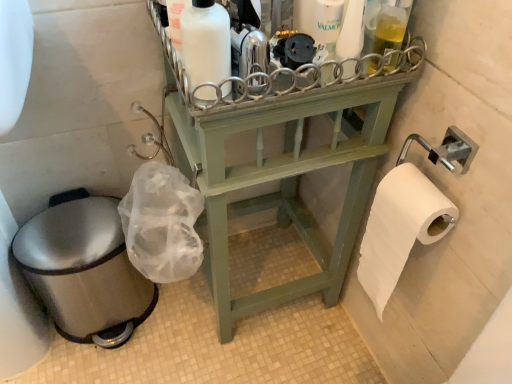
Measure the distance between brushed metal toilet bowl at lower left and camera.

brushed metal toilet bowl at lower left is 33.83 inches away from camera.

Measure the distance between light green wood shelf at center and camera.

light green wood shelf at center is 58.00 centimeters from camera.

The image size is (512, 384). Describe the element at coordinates (205, 42) in the screenshot. I see `white matte bottle at upper center` at that location.

Measure the distance between white matte bottle at upper center and camera.

They are 20.39 inches apart.

The image size is (512, 384). What do you see at coordinates (351, 31) in the screenshot? I see `white plastic bottle at upper center` at bounding box center [351, 31].

The image size is (512, 384). In order to click on white plastic bottle at upper center in this screenshot , I will do `click(351, 31)`.

Identify the location of brushed metal toilet bowl at lower left. (84, 271).

Is white matte bottle at upper center oriented towards brushed metal toilet bowl at lower left?

No, white matte bottle at upper center is not oriented towards brushed metal toilet bowl at lower left.

Is white matte bottle at upper center next to brushed metal toilet bowl at lower left?

white matte bottle at upper center and brushed metal toilet bowl at lower left are clearly separated.

Is brushed metal toilet bowl at lower left located within white matte bottle at upper center?

No, brushed metal toilet bowl at lower left is not surrounded by white matte bottle at upper center.

Who is bigger, light green wood shelf at center or white plastic bottle at upper center?

With larger size is light green wood shelf at center.

Does light green wood shelf at center appear on the left side of white plastic bottle at upper center?

Yes, light green wood shelf at center is to the left of white plastic bottle at upper center.

Measure the distance between light green wood shelf at center and white plastic bottle at upper center.

light green wood shelf at center and white plastic bottle at upper center are 15.11 inches apart from each other.

Can you confirm if brushed metal toilet bowl at lower left is shorter than white matte bottle at upper center?

No.

Does brushed metal toilet bowl at lower left have a smaller size compared to white matte bottle at upper center?

No.

Consider the image. From the image's perspective, is brushed metal toilet bowl at lower left below white matte bottle at upper center?

Yes, from the image's perspective, brushed metal toilet bowl at lower left is below white matte bottle at upper center.

Is white plastic bottle at upper center surrounding white matte bottle at upper center?

No, white matte bottle at upper center is not a part of white plastic bottle at upper center.

Considering the relative sizes of white plastic bottle at upper center and white matte bottle at upper center in the image provided, is white plastic bottle at upper center shorter than white matte bottle at upper center?

No.

From the image's perspective, which is above, white plastic bottle at upper center or white matte bottle at upper center?

white plastic bottle at upper center appears higher in the image.

Which object is closer to the camera taking this photo, white plastic bottle at upper center or white matte bottle at upper center?

Result: white matte bottle at upper center is closer to the camera.

From a real-world perspective, between light green wood shelf at center and white matte bottle at upper center, who is vertically lower?

light green wood shelf at center is physically lower.

Considering the relative sizes of light green wood shelf at center and white matte bottle at upper center in the image provided, is light green wood shelf at center taller than white matte bottle at upper center?

Yes.

Is light green wood shelf at center positioned beyond the bounds of white matte bottle at upper center?

Yes, light green wood shelf at center is outside of white matte bottle at upper center.

How many degrees apart are the facing directions of light green wood shelf at center and white matte bottle at upper center?

light green wood shelf at center and white matte bottle at upper center are facing 1 degrees away from each other.

Would you say white matte bottle at upper center is a long distance from light green wood shelf at center?

They are positioned close to each other.

From a real-world perspective, between white matte bottle at upper center and light green wood shelf at center, who is vertically lower?

light green wood shelf at center is physically lower.

Which object is wider, white matte bottle at upper center or light green wood shelf at center?

With larger width is light green wood shelf at center.

Considering the relative positions of brushed metal toilet bowl at lower left and white plastic bottle at upper center in the image provided, is brushed metal toilet bowl at lower left behind white plastic bottle at upper center?

Yes, the depth of brushed metal toilet bowl at lower left is greater than that of white plastic bottle at upper center.

Can you confirm if brushed metal toilet bowl at lower left is wider than white plastic bottle at upper center?

Yes.

Where is `toilet bowl behind the white plastic bottle at upper center`? This screenshot has height=384, width=512. toilet bowl behind the white plastic bottle at upper center is located at coordinates (84, 271).

Which object is positioned more to the left, brushed metal toilet bowl at lower left or white plastic bottle at upper center?

From the viewer's perspective, brushed metal toilet bowl at lower left appears more on the left side.

At what (x,y) coordinates should I click in order to perform the action: click on cleaning product on the right of brushed metal toilet bowl at lower left. Please return your answer as a coordinate pair (x, y). Looking at the image, I should click on (205, 42).

In the image, there is a light green wood shelf at center. Identify the location of toiletry above it (from the image's perspective). This screenshot has height=384, width=512. (351, 31).

Considering their positions, is brushed metal toilet bowl at lower left positioned further to light green wood shelf at center than white plastic bottle at upper center?

Based on the image, white plastic bottle at upper center appears to be further to light green wood shelf at center.

Estimate the real-world distances between objects in this image. Which object is closer to white matte bottle at upper center, brushed metal toilet bowl at lower left or white plastic bottle at upper center?

The object closer to white matte bottle at upper center is white plastic bottle at upper center.

Looking at the image, which one is located closer to white plastic bottle at upper center, brushed metal toilet bowl at lower left or white matte bottle at upper center?

white matte bottle at upper center.

Based on their spatial positions, is white matte bottle at upper center or brushed metal toilet bowl at lower left closer to white plastic bottle at upper center?

white matte bottle at upper center lies closer to white plastic bottle at upper center than the other object.

From the image, which object appears to be farther from light green wood shelf at center, white plastic bottle at upper center or white matte bottle at upper center?

white matte bottle at upper center is further to light green wood shelf at center.

Estimate the real-world distances between objects in this image. Which object is further from brushed metal toilet bowl at lower left, light green wood shelf at center or white plastic bottle at upper center?

white plastic bottle at upper center lies further to brushed metal toilet bowl at lower left than the other object.

Looking at the image, which one is located closer to brushed metal toilet bowl at lower left, white plastic bottle at upper center or white matte bottle at upper center?

white matte bottle at upper center.

Based on their spatial positions, is light green wood shelf at center or white matte bottle at upper center closer to white plastic bottle at upper center?

The object closer to white plastic bottle at upper center is white matte bottle at upper center.

I want to click on cleaning product between brushed metal toilet bowl at lower left and white plastic bottle at upper center from left to right, so click(205, 42).

Identify the location of cleaning product between brushed metal toilet bowl at lower left and light green wood shelf at center in the horizontal direction. (205, 42).

What are the coordinates of `furniture between brushed metal toilet bowl at lower left and white plastic bottle at upper center from left to right` in the screenshot? It's located at [x=283, y=181].

In order to click on cleaning product between white plastic bottle at upper center and light green wood shelf at center vertically in this screenshot , I will do `click(205, 42)`.